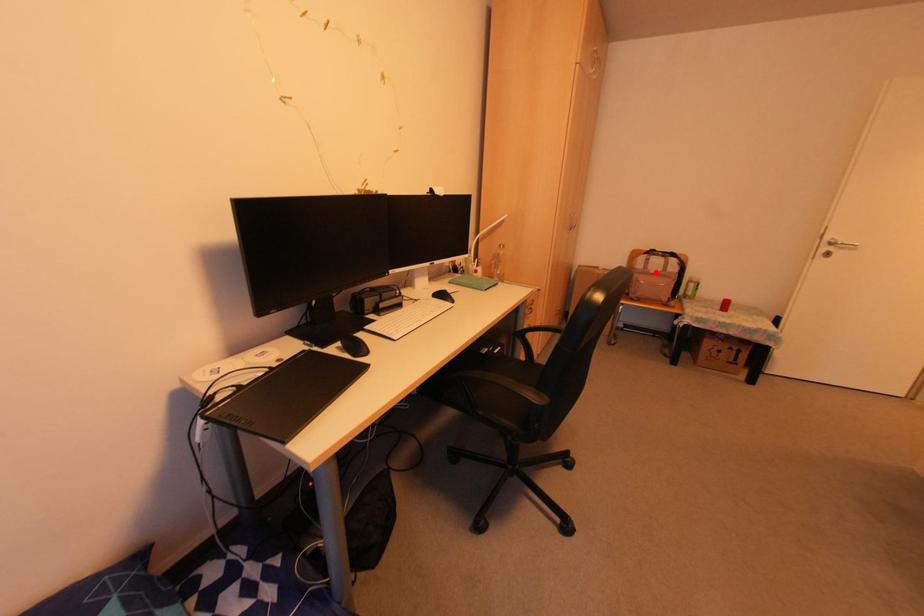
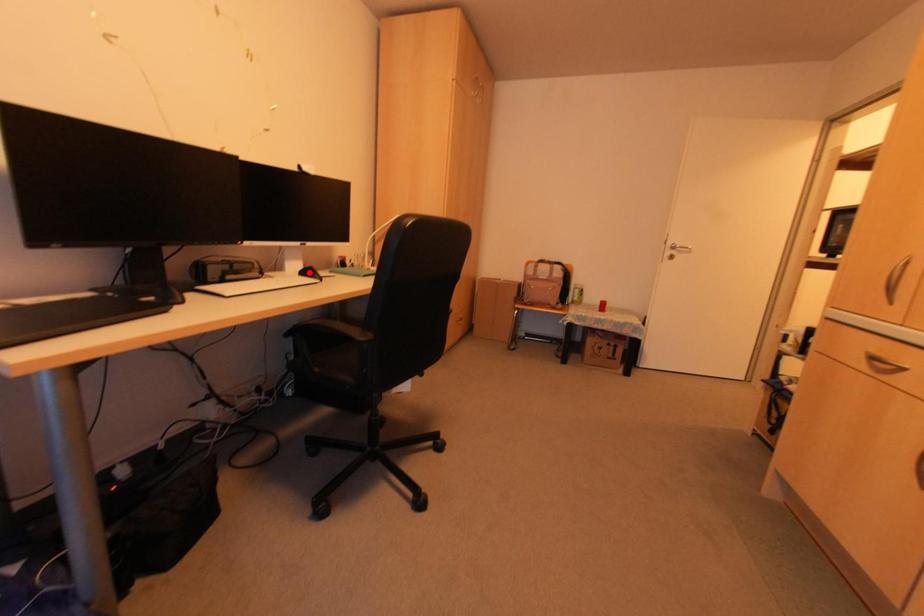
I am providing you with two images of the same scene from different viewpoints. A red point is marked on the first image and another point is marked on the second image. Do the highlighted points in image1 and image2 indicate the same real-world spot?

No